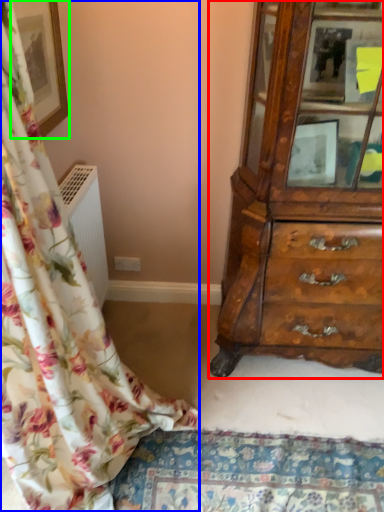
Question: Which is nearer to the chest of drawers (highlighted by a red box)? curtain (highlighted by a blue box) or picture frame (highlighted by a green box).

Choices:
 (A) curtain
 (B) picture frame

Answer: (A)